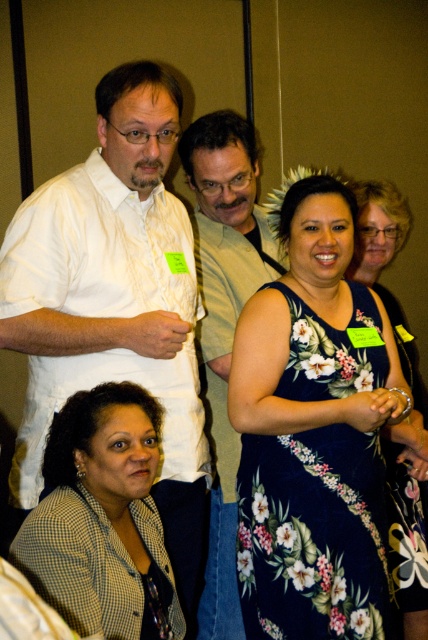
You are organizing a photo shoot and need to ensure proper spacing between the models. The checkered fabric blouse at lower left and the floral print dress at center are part of the setup. Given that the minimum required distance between any two models is 30 inches, can you confirm if the current spacing between them meets this requirement?

The checkered fabric blouse at lower left and floral print dress at center are 33.13 inches apart, which exceeds the minimum required distance of 30 inches. Therefore, the spacing between them meets the requirement.

You are standing in the room and want to hand a gift to the person wearing the floral print dress at center. Which direction should you move to approach them from the white shirt at upper left?

The white shirt at upper left is closer to the viewer than the floral print dress at center, so you should move towards the center of the room away from the white shirt at upper left to reach the floral print dress at center.

From the picture: You are a photographer adjusting your camera settings to capture the group photo. You notice the dark blue floral dress at center and the checkered fabric blouse at lower left in your viewfinder. Which clothing item should you focus on first if you want to ensure both are in focus, considering their positions?

The dark blue floral dress at center is much taller than the checkered fabric blouse at lower left, so focusing on the dark blue floral dress at center first would help ensure both are in focus since it is farther away.